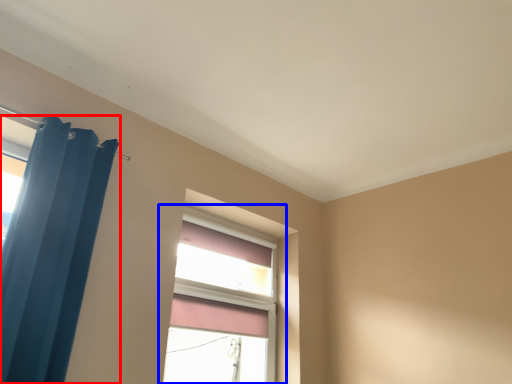
Question: Among these objects, which one is nearest to the camera, curtain (highlighted by a red box) or window (highlighted by a blue box)?

Choices:
 (A) curtain
 (B) window

Answer: (A)